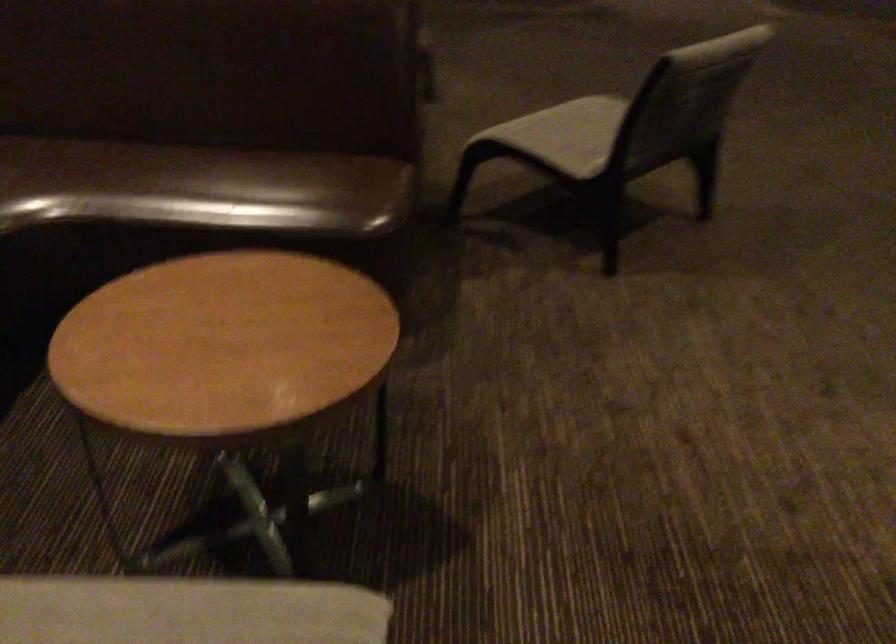
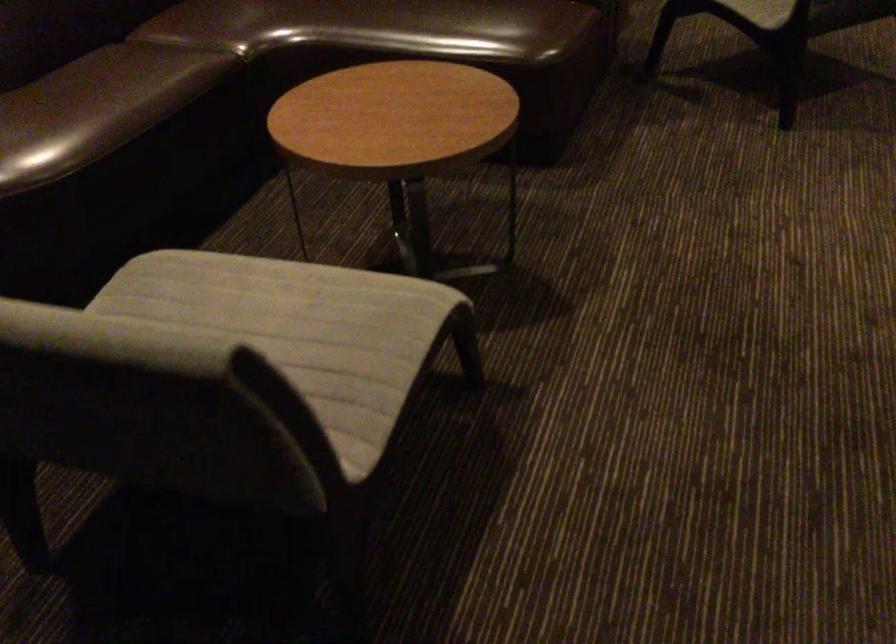
In the second image, find the point that corresponds to [254,198] in the first image.

(444, 26)